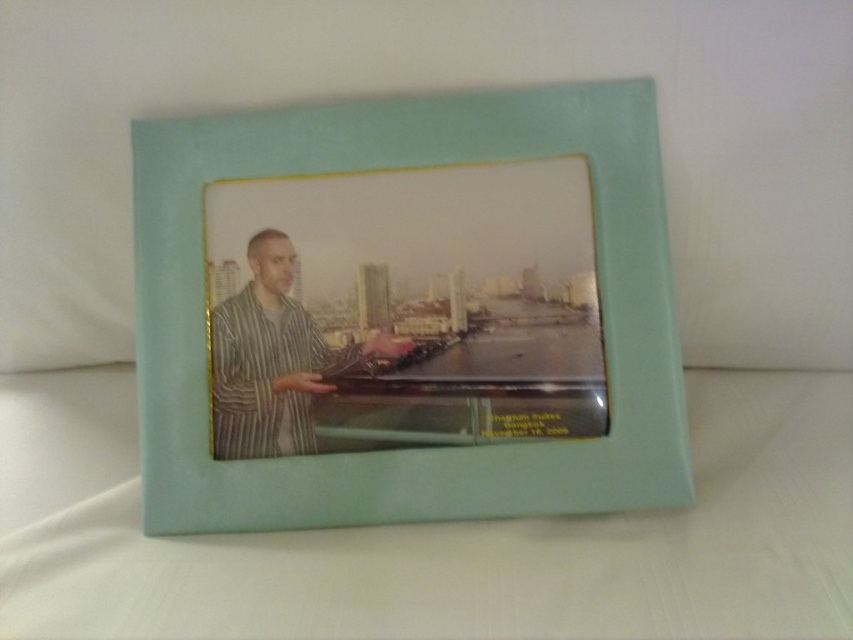
You are an interior designer arranging a shelf. You have a mint green leather picture frame at center and a striped fabric man at center. The shelf has limited space. Which object should you place first to ensure both fit?

The mint green leather picture frame at center is wider than the striped fabric man at center. Place the wider frame first to accommodate both items on the shelf.

Looking at this image, you are hanging a mint green leather picture frame at center on a wall. The hook is 30 inches from the floor. If the frame is 32.80 inches from the camera, will the bottom of the frame be above the hook?

The mint green leather picture frame at center is 32.80 inches from the camera. The hook is 30 inches from the floor. Since the frame is further away than the hook, the bottom of the frame will be above the hook.

You are an interior designer assessing the placement of a new painting in a room. The room already has a mint green leather picture frame at center. You want to place a new painting such that its center aligns with the point at coordinates point [410,449]. Will the new painting overlap with the mint green leather picture frame at center?

The point [410,449] corresponds to the mint green leather picture frame at center, so placing the new painting there would overlap with the mint green leather picture frame at center.